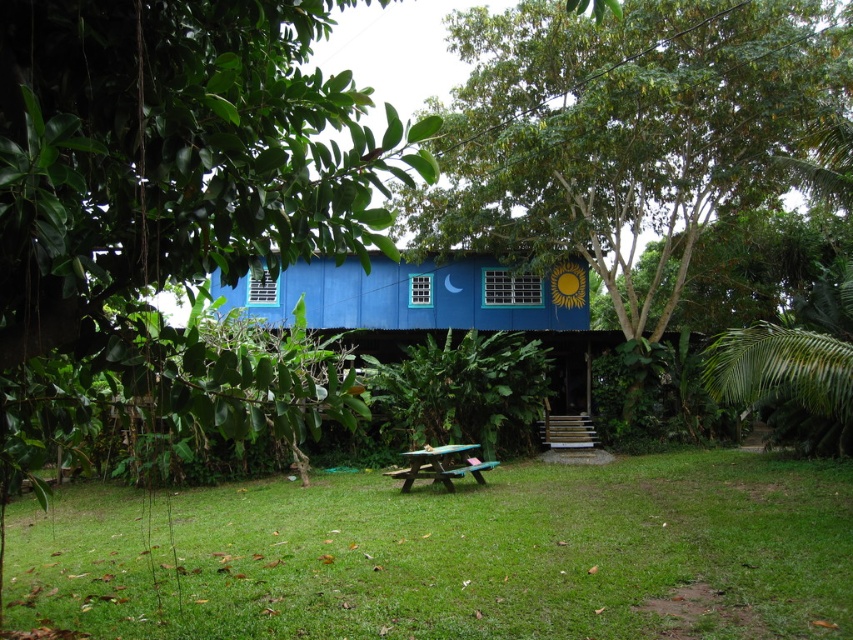
Question: Estimate the real-world distances between objects in this image. Which object is closer to the green grass at center?

Choices:
 (A) wooden picnic table at center
 (B) green leafy tree at left
 (C) green leafy tree at center

Answer: (A)

Question: Does green grass at center come in front of green leafy tree at center?

Choices:
 (A) no
 (B) yes

Answer: (A)

Question: Which object is closer to the camera taking this photo?

Choices:
 (A) green leafy tree at center
 (B) green grass at center
 (C) blue painted wood hut at center

Answer: (C)

Question: Does green leafy tree at center appear over wooden picnic table at center?

Choices:
 (A) yes
 (B) no

Answer: (A)

Question: Which of the following is the farthest from the observer?

Choices:
 (A) wooden picnic table at center
 (B) green grass at center

Answer: (A)

Question: Does green leafy tree at left have a greater width compared to wooden picnic table at center?

Choices:
 (A) no
 (B) yes

Answer: (A)